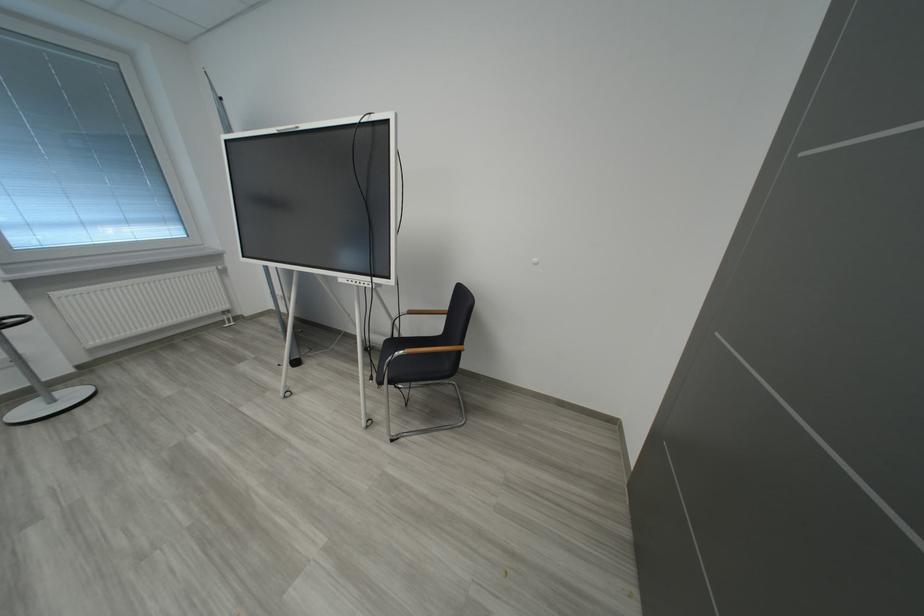
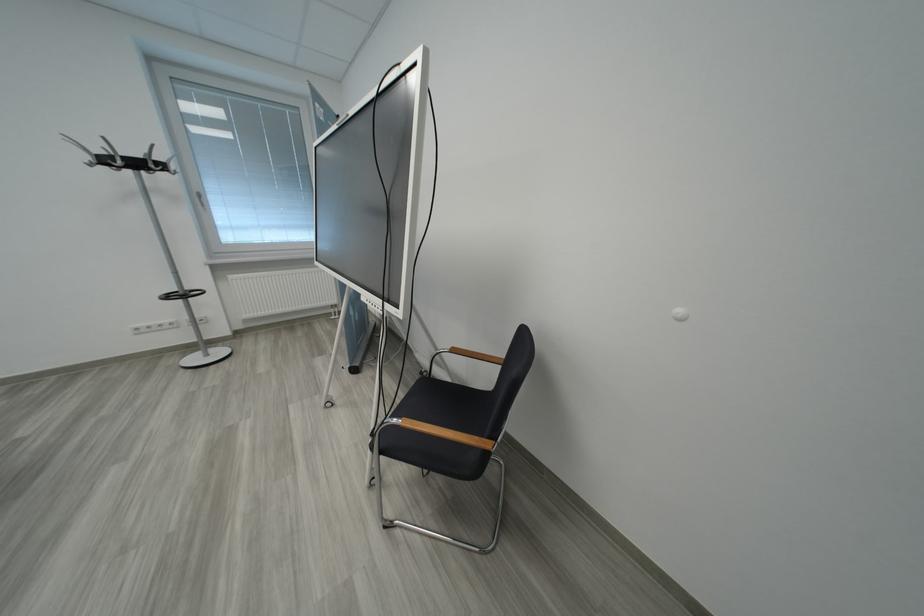
Question: How did the camera likely rotate?

Choices:
 (A) Left
 (B) Right
 (C) Up
 (D) Down

Answer: (A)